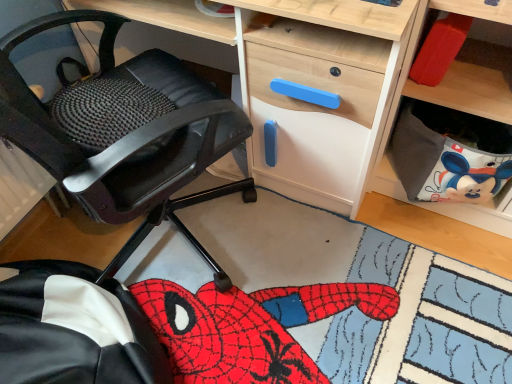
The height and width of the screenshot is (384, 512). Find the location of `black leather chair at left`. black leather chair at left is located at coordinates (124, 132).

You are a GUI agent. You are given a task and a screenshot of the screen. Output one action in this format:
    pyautogui.click(x=<x>, y=<y>)
    Task: Click on the wooden desk at center
    
    Given the screenshot: What is the action you would take?
    pyautogui.click(x=439, y=233)

The width and height of the screenshot is (512, 384). Describe the element at coordinates (439, 233) in the screenshot. I see `wooden desk at center` at that location.

Locate an element on the screen. black leather chair at left is located at coordinates (124, 132).

Does wooden desk at center have a greater width compared to gray fabric bag at lower right?

Correct, the width of wooden desk at center exceeds that of gray fabric bag at lower right.

Is wooden desk at center next to gray fabric bag at lower right and touching it?

No, wooden desk at center is not with gray fabric bag at lower right.

What are the coordinates of `shelf on the right side of wooden desk at center` in the screenshot? It's located at (463, 68).

How much distance is there between wooden desk at center and gray fabric bag at lower right?

The distance of wooden desk at center from gray fabric bag at lower right is 10.58 inches.

Can you see black leather chair at left touching wooden desk at center?

No, black leather chair at left is not beside wooden desk at center.

From a real-world perspective, is black leather chair at left above or below wooden desk at center?

Clearly, from a real-world perspective, black leather chair at left is above wooden desk at center.

Considering the points (99, 72) and (215, 25), which point is in front, point (99, 72) or point (215, 25)?

The point (215, 25) is more forward.

Based on the photo, from the image's perspective, is black leather chair at left on top of wooden desk at center?

Incorrect, from the image's perspective, black leather chair at left is lower than wooden desk at center.

Does point (485, 54) lie in front of point (422, 213)?

Yes, it is.

From a real-world perspective, between gray fabric bag at lower right and wooden desk at center, who is vertically lower?

From a 3D spatial view, gray fabric bag at lower right is below.

Identify the location of shelf behind the wooden desk at center. The width and height of the screenshot is (512, 384). (463, 68).

From the picture: Is gray fabric bag at lower right spatially inside wooden desk at center, or outside of it?

gray fabric bag at lower right is outside wooden desk at center.

Would you say gray fabric bag at lower right is to the left or to the right of black leather chair at left in the picture?

Based on their positions, gray fabric bag at lower right is located to the right of black leather chair at left.

Is there a large distance between gray fabric bag at lower right and black leather chair at left?

No, gray fabric bag at lower right is not far from black leather chair at left.

From the image's perspective, is gray fabric bag at lower right under black leather chair at left?

Yes, from the image's perspective, gray fabric bag at lower right is beneath black leather chair at left.

Could black leather chair at left be considered to be inside gray fabric bag at lower right?

No.

Is black leather chair at left positioned before gray fabric bag at lower right?

Yes.

The height and width of the screenshot is (384, 512). Find the location of `shelf that appears on the right of black leather chair at left`. shelf that appears on the right of black leather chair at left is located at coordinates (463, 68).

Based on the photo, from the image's perspective, is black leather chair at left above gray fabric bag at lower right?

Yes.

Is black leather chair at left looking in the opposite direction of gray fabric bag at lower right?

black leather chair at left does not have its back to gray fabric bag at lower right.

Which object is more forward, wooden desk at center or black leather chair at left?

black leather chair at left is closer to the camera.

Is point (439, 243) behind point (16, 100)?

Yes, it is behind point (16, 100).

Is the surface of wooden desk at center in direct contact with black leather chair at left?

No, wooden desk at center is not next to black leather chair at left.

You are a GUI agent. You are given a task and a screenshot of the screen. Output one action in this format:
    pyautogui.click(x=<x>, y=<y>)
    Task: Click on the shelf below the wooden desk at center (from the image's perspective)
    The image size is (512, 384).
    Given the screenshot: What is the action you would take?
    pyautogui.click(x=463, y=68)

Where is `chair in front of the wooden desk at center`? This screenshot has width=512, height=384. chair in front of the wooden desk at center is located at coordinates (124, 132).

From the image, which object appears to be farther from gray fabric bag at lower right, wooden desk at center or black leather chair at left?

black leather chair at left is positioned further to the anchor gray fabric bag at lower right.

From the image, which object appears to be farther from black leather chair at left, wooden desk at center or gray fabric bag at lower right?

wooden desk at center is further to black leather chair at left.

Estimate the real-world distances between objects in this image. Which object is further from wooden desk at center, gray fabric bag at lower right or black leather chair at left?

black leather chair at left.

When comparing their distances from black leather chair at left, does gray fabric bag at lower right or wooden desk at center seem further?

wooden desk at center.

When comparing their distances from gray fabric bag at lower right, does black leather chair at left or wooden desk at center seem closer?

wooden desk at center.

Looking at the image, which one is located closer to wooden desk at center, black leather chair at left or gray fabric bag at lower right?

The object closer to wooden desk at center is gray fabric bag at lower right.

Locate an element on the screen. This screenshot has width=512, height=384. desk situated between black leather chair at left and gray fabric bag at lower right from left to right is located at coordinates (439, 233).